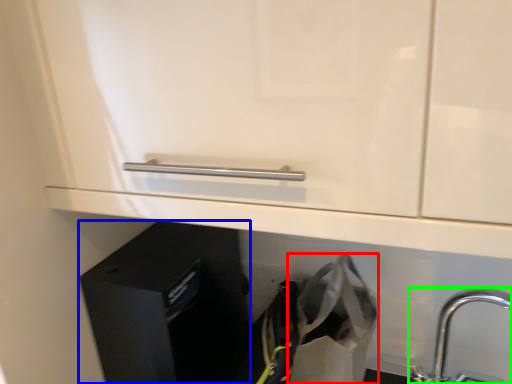
Question: Which object is the farthest from shopping bag (highlighted by a red box)? Choose among these: file cabinet (highlighted by a blue box) or tap (highlighted by a green box).

Choices:
 (A) file cabinet
 (B) tap

Answer: (A)